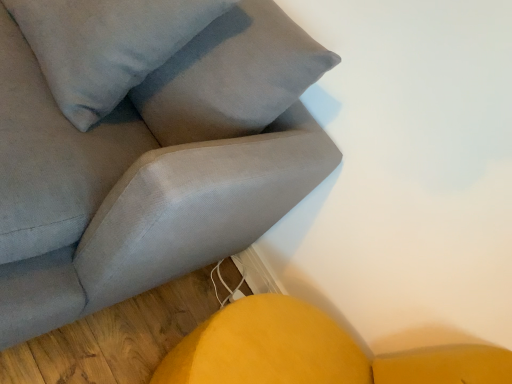
Find the location of a particular element. The width and height of the screenshot is (512, 384). suede gray couch at upper left is located at coordinates (x=152, y=167).

Measure the distance between point (163, 210) and camera.

Point (163, 210) is 30.51 inches away from camera.

Measure the distance between suede gray couch at upper left and camera.

suede gray couch at upper left is 30.07 inches away from camera.

The image size is (512, 384). Describe the element at coordinates (152, 167) in the screenshot. I see `suede gray couch at upper left` at that location.

What is the approximate height of suede gray couch at upper left?

It is 34.69 inches.

Looking at this image, what is the approximate width of satin gray pillow at upper left?

satin gray pillow at upper left is 15.12 inches in width.

What do you see at coordinates (106, 45) in the screenshot? I see `satin gray pillow at upper left` at bounding box center [106, 45].

Where is `satin gray pillow at upper left`? This screenshot has width=512, height=384. satin gray pillow at upper left is located at coordinates (106, 45).

In order to face satin gray pillow at upper left, should I rotate leftwards or rightwards?

To face it directly, rotate left by 20.655 degrees.

In order to click on suede gray couch at upper left in this screenshot , I will do `click(152, 167)`.

Between satin gray pillow at upper left and suede gray couch at upper left, which one appears on the right side from the viewer's perspective?

From the viewer's perspective, satin gray pillow at upper left appears more on the right side.

Is satin gray pillow at upper left further to camera compared to suede gray couch at upper left?

Yes, satin gray pillow at upper left is behind suede gray couch at upper left.

Considering the positions of point (66, 37) and point (103, 238), is point (66, 37) closer or farther from the camera than point (103, 238)?

Point (66, 37) appears to be farther away from the viewer than point (103, 238).

From the image's perspective, between satin gray pillow at upper left and suede gray couch at upper left, which one is located above?

satin gray pillow at upper left.

From a real-world perspective, is satin gray pillow at upper left on suede gray couch at upper left?

Yes.

In terms of width, does satin gray pillow at upper left look wider or thinner when compared to suede gray couch at upper left?

Clearly, satin gray pillow at upper left has less width compared to suede gray couch at upper left.

Which of these two, satin gray pillow at upper left or suede gray couch at upper left, stands taller?

With more height is suede gray couch at upper left.

Considering the sizes of satin gray pillow at upper left and suede gray couch at upper left in the image, is satin gray pillow at upper left bigger or smaller than suede gray couch at upper left?

Clearly, satin gray pillow at upper left is smaller in size than suede gray couch at upper left.

Which is correct: satin gray pillow at upper left is inside suede gray couch at upper left, or outside of it?

satin gray pillow at upper left exists entirely within suede gray couch at upper left.

Is satin gray pillow at upper left far from suede gray couch at upper left?

They are positioned close to each other.

Could you tell me if satin gray pillow at upper left is facing suede gray couch at upper left?

Yes, satin gray pillow at upper left is aimed at suede gray couch at upper left.

Can you tell me how much satin gray pillow at upper left and suede gray couch at upper left differ in facing direction?

There is a 0.985-degree angle between the facing directions of satin gray pillow at upper left and suede gray couch at upper left.

The height and width of the screenshot is (384, 512). Find the location of `pillow behind the suede gray couch at upper left`. pillow behind the suede gray couch at upper left is located at coordinates (106, 45).

Between suede gray couch at upper left and satin gray pillow at upper left, which one appears on the left side from the viewer's perspective?

suede gray couch at upper left is more to the left.

Between suede gray couch at upper left and satin gray pillow at upper left, which one is positioned in front?

suede gray couch at upper left is more forward.

Which is farther, (41, 304) or (62, 7)?

Point (62, 7)

From the image's perspective, is suede gray couch at upper left under satin gray pillow at upper left?

Yes, from the image's perspective, suede gray couch at upper left is beneath satin gray pillow at upper left.

From a real-world perspective, is suede gray couch at upper left located beneath satin gray pillow at upper left?

Yes, from a real-world perspective, suede gray couch at upper left is beneath satin gray pillow at upper left.

Considering the sizes of suede gray couch at upper left and satin gray pillow at upper left in the image, is suede gray couch at upper left wider or thinner than satin gray pillow at upper left?

Considering their sizes, suede gray couch at upper left looks broader than satin gray pillow at upper left.

Is suede gray couch at upper left taller than satin gray pillow at upper left?

Yes.

Which of these two, suede gray couch at upper left or satin gray pillow at upper left, is bigger?

With larger size is suede gray couch at upper left.

Is suede gray couch at upper left completely or partially outside of satin gray pillow at upper left?

Yes, suede gray couch at upper left is located beyond the bounds of satin gray pillow at upper left.

From the picture: Is suede gray couch at upper left next to satin gray pillow at upper left and touching it?

No.

Does suede gray couch at upper left turn towards satin gray pillow at upper left?

Yes, suede gray couch at upper left is oriented towards satin gray pillow at upper left.

You are a GUI agent. You are given a task and a screenshot of the screen. Output one action in this format:
    pyautogui.click(x=<x>, y=<y>)
    Task: Click on the pillow behind the suede gray couch at upper left
    Image resolution: width=512 pixels, height=384 pixels.
    Given the screenshot: What is the action you would take?
    pyautogui.click(x=106, y=45)

This screenshot has width=512, height=384. Identify the location of pillow behind the suede gray couch at upper left. (106, 45).

Find the location of a particular element. The width and height of the screenshot is (512, 384). studio couch on the left of satin gray pillow at upper left is located at coordinates (152, 167).